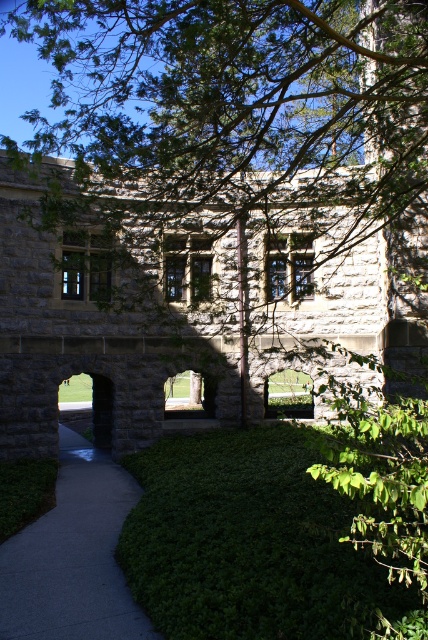
Between point (338, 570) and point (0, 580), which one is positioned in front?

Point (338, 570) is in front.

How much distance is there between green leafy bush at lower center and gray concrete sidewalk at lower left?

green leafy bush at lower center is 3.99 feet from gray concrete sidewalk at lower left.

Which is in front, point (157, 497) or point (64, 433)?

Point (157, 497)

Image resolution: width=428 pixels, height=640 pixels. What are the coordinates of `green leafy bush at lower center` in the screenshot? It's located at (249, 541).